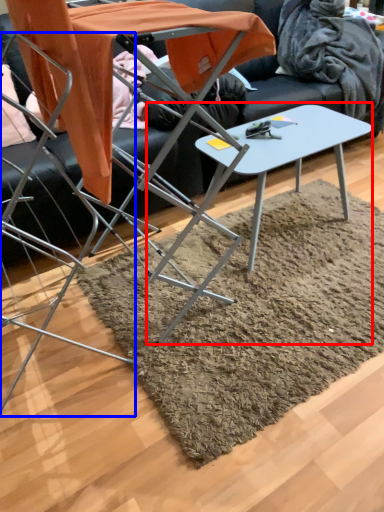
Question: Which object is further to the camera taking this photo, table (highlighted by a red box) or chair (highlighted by a blue box)?

Choices:
 (A) table
 (B) chair

Answer: (A)